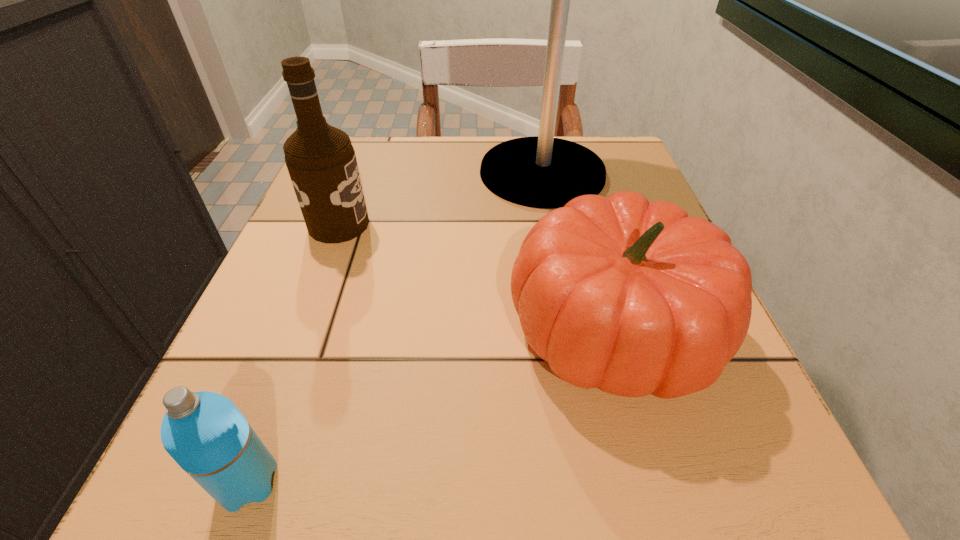
Where is `alcohol at the left edge`? The height and width of the screenshot is (540, 960). alcohol at the left edge is located at coordinates (321, 161).

The height and width of the screenshot is (540, 960). I want to click on thermos bottle located in the left edge section of the desktop, so click(x=204, y=432).

Locate an element on the screen. Image resolution: width=960 pixels, height=540 pixels. table lamp that is at the right edge is located at coordinates (544, 172).

The height and width of the screenshot is (540, 960). I want to click on pumpkin that is positioned at the right edge, so tap(633, 297).

The width and height of the screenshot is (960, 540). I want to click on object situated at the near left corner, so click(x=204, y=432).

This screenshot has height=540, width=960. What are the coordinates of `object present at the far right corner` in the screenshot? It's located at point(544,172).

Where is `free point at the far edge`? This screenshot has height=540, width=960. free point at the far edge is located at coordinates (455, 151).

The height and width of the screenshot is (540, 960). In order to click on vacant space at the near edge in this screenshot , I will do `click(517, 455)`.

Locate an element on the screen. Image resolution: width=960 pixels, height=540 pixels. free location at the left edge of the desktop is located at coordinates (341, 309).

Locate an element on the screen. This screenshot has height=540, width=960. free spot at the far left corner of the desktop is located at coordinates (391, 159).